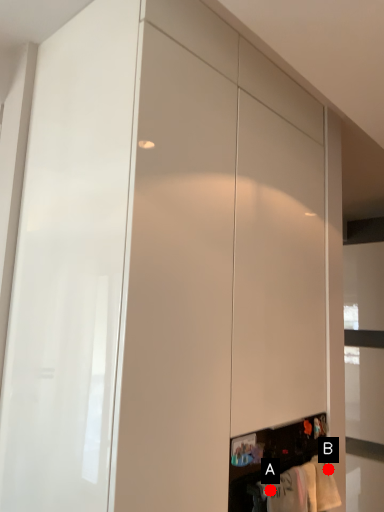
Question: Two points are circled on the image, labeled by A and B beside each circle. Among these points, which one is nearest to the camera?

Choices:
 (A) A is closer
 (B) B is closer

Answer: (A)